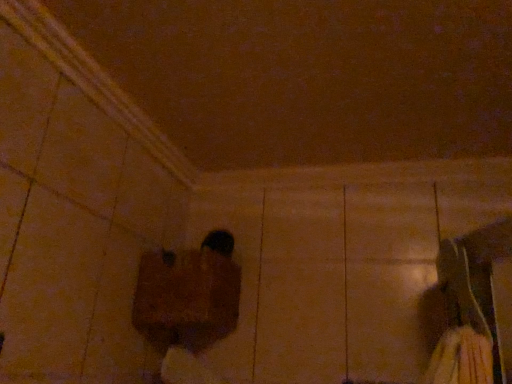
Question: From a real-world perspective, relative to wooden block at lower center, is black matte shoe at center vertically above or below?

Choices:
 (A) below
 (B) above

Answer: (B)

Question: From the image's perspective, is black matte shoe at center above or below wooden block at lower center?

Choices:
 (A) below
 (B) above

Answer: (B)

Question: In the image, is black matte shoe at center on the left side or the right side of wooden block at lower center?

Choices:
 (A) right
 (B) left

Answer: (A)

Question: In terms of width, does wooden block at lower center look wider or thinner when compared to black matte shoe at center?

Choices:
 (A) wide
 (B) thin

Answer: (A)

Question: Is wooden block at lower center inside or outside of black matte shoe at center?

Choices:
 (A) inside
 (B) outside

Answer: (B)

Question: From a real-world perspective, is wooden block at lower center physically located above or below black matte shoe at center?

Choices:
 (A) above
 (B) below

Answer: (B)

Question: From the image's perspective, is wooden block at lower center located above or below black matte shoe at center?

Choices:
 (A) above
 (B) below

Answer: (B)